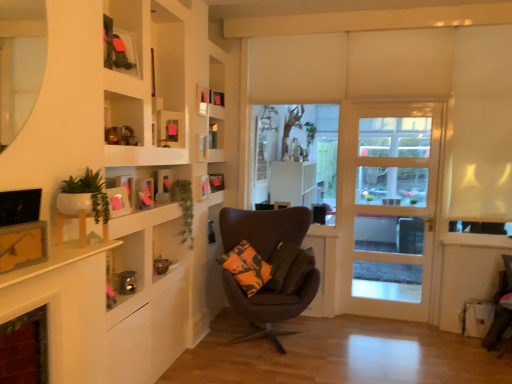
Question: Is wooden shelves at upper left oriented towards metallic silver frame at upper left?

Choices:
 (A) no
 (B) yes

Answer: (B)

Question: Are wooden shelves at upper left and metallic silver frame at upper left far apart?

Choices:
 (A) no
 (B) yes

Answer: (A)

Question: Can you confirm if wooden shelves at upper left is shorter than metallic silver frame at upper left?

Choices:
 (A) no
 (B) yes

Answer: (A)

Question: Considering the relative positions of wooden shelves at upper left and metallic silver frame at upper left in the image provided, is wooden shelves at upper left to the right of metallic silver frame at upper left from the viewer's perspective?

Choices:
 (A) yes
 (B) no

Answer: (A)

Question: Can you confirm if wooden shelves at upper left is wider than metallic silver frame at upper left?

Choices:
 (A) yes
 (B) no

Answer: (A)

Question: From the image's perspective, is wooden shelves at upper left on top of metallic silver frame at upper left?

Choices:
 (A) yes
 (B) no

Answer: (B)

Question: Is green leafy plant at upper left, placed as the 2th plant when sorted from front to back, at the back of pink paper picture frame at left, the 2th picture frame from the front?

Choices:
 (A) no
 (B) yes

Answer: (A)

Question: Would you say pink paper picture frame at left, the 2th picture frame from the front, is a long distance from green leafy plant at upper left, marked as the 1th plant in a back-to-front arrangement?

Choices:
 (A) no
 (B) yes

Answer: (A)

Question: Is pink paper picture frame at left, which ranks as the 10th picture frame in back-to-front order, bigger than green leafy plant at upper left, marked as the 1th plant in a back-to-front arrangement?

Choices:
 (A) no
 (B) yes

Answer: (A)

Question: Is pink paper picture frame at left, which ranks as the 10th picture frame in back-to-front order, placed right next to green leafy plant at upper left, marked as the 1th plant in a back-to-front arrangement?

Choices:
 (A) yes
 (B) no

Answer: (B)

Question: Considering the relative sizes of pink paper picture frame at left, which ranks as the 10th picture frame in back-to-front order, and green leafy plant at upper left, placed as the 2th plant when sorted from front to back, in the image provided, is pink paper picture frame at left, which ranks as the 10th picture frame in back-to-front order, wider than green leafy plant at upper left, placed as the 2th plant when sorted from front to back,?

Choices:
 (A) no
 (B) yes

Answer: (A)

Question: From the image's perspective, is pink paper picture frame at left, which ranks as the 10th picture frame in back-to-front order, over green leafy plant at upper left, placed as the 2th plant when sorted from front to back?

Choices:
 (A) no
 (B) yes

Answer: (B)

Question: Does pink paper picture frame at left, the 2th picture frame from the front, have a larger size compared to pink matte picture frame at upper center, arranged as the 4th picture frame when viewed from the front?

Choices:
 (A) yes
 (B) no

Answer: (A)